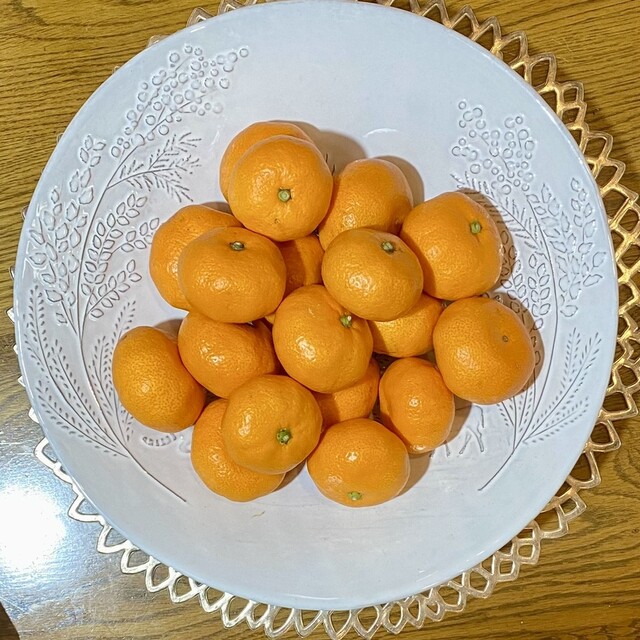
Image resolution: width=640 pixels, height=640 pixels. What are the coordinates of `wooden table` in the screenshot? It's located at (587, 588).